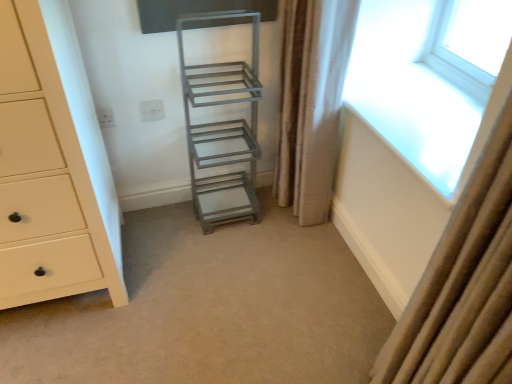
The width and height of the screenshot is (512, 384). Identify the location of vacant space to the right of matte cream chest of drawers at left. (188, 275).